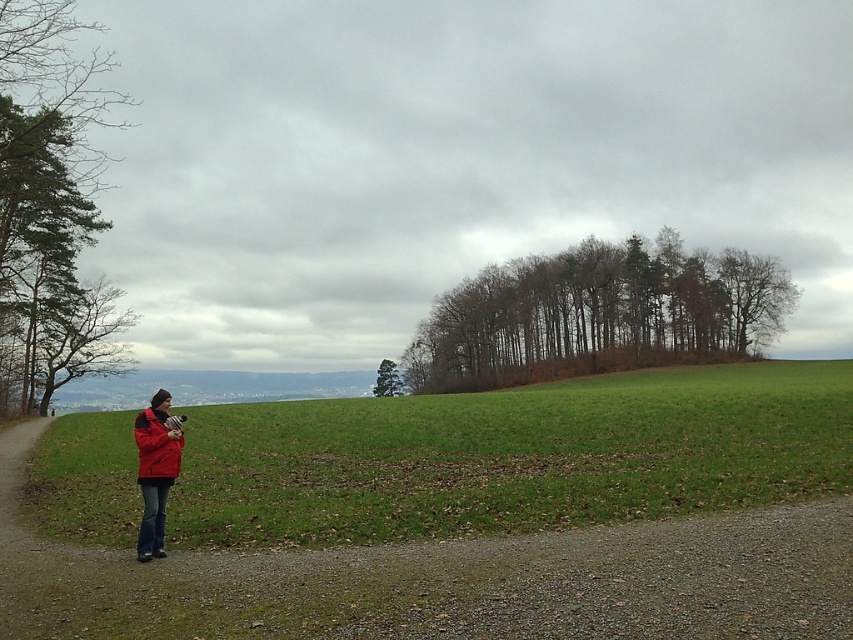
Does matte red jacket at left have a lesser height compared to matte red jacket at lower left?

Yes, matte red jacket at left is shorter than matte red jacket at lower left.

Can you confirm if matte red jacket at left is taller than matte red jacket at lower left?

In fact, matte red jacket at left may be shorter than matte red jacket at lower left.

Between point (172, 467) and point (138, 467), which one is positioned behind?

Point (172, 467)

The width and height of the screenshot is (853, 640). Find the location of `matte red jacket at left`. matte red jacket at left is located at coordinates (155, 470).

Is green grassy field at lower left to the right of matte red jacket at lower left from the viewer's perspective?

Correct, you'll find green grassy field at lower left to the right of matte red jacket at lower left.

Is point (64, 435) farther from viewer compared to point (141, 436)?

Yes, it is behind point (141, 436).

The width and height of the screenshot is (853, 640). In order to click on green grassy field at lower left in this screenshot , I will do `click(512, 456)`.

Is brown leafy trees at center further to the viewer compared to matte red jacket at lower left?

That is True.

This screenshot has height=640, width=853. Describe the element at coordinates (598, 314) in the screenshot. I see `brown leafy trees at center` at that location.

The width and height of the screenshot is (853, 640). Identify the location of brown leafy trees at center. (598, 314).